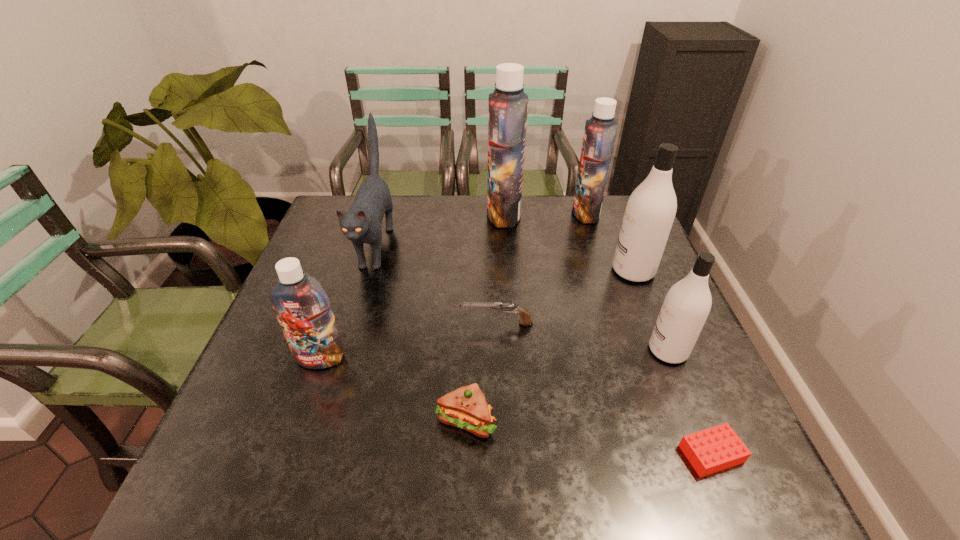
Where is `vacant area in the image that satisfies the following two spatial constraints: 1. aiming along the barrel of the fifth farthest object; 2. on the left side of the Lego`? The height and width of the screenshot is (540, 960). vacant area in the image that satisfies the following two spatial constraints: 1. aiming along the barrel of the fifth farthest object; 2. on the left side of the Lego is located at coordinates (502, 454).

Identify the location of blank space that satisfies the following two spatial constraints: 1. on the front-facing side of the farther white shampoo; 2. on the front label of the leftmost blue shampoo. (669, 359).

Image resolution: width=960 pixels, height=540 pixels. I want to click on free region that satisfies the following two spatial constraints: 1. on the front-facing side of the shortest object; 2. on the left side of the nearer white shampoo, so click(x=710, y=454).

Where is `vacant space that satisfies the following two spatial constraints: 1. on the front label of the leftmost blue shampoo; 2. on the left side of the shortest object`? vacant space that satisfies the following two spatial constraints: 1. on the front label of the leftmost blue shampoo; 2. on the left side of the shortest object is located at coordinates (288, 454).

You are a GUI agent. You are given a task and a screenshot of the screen. Output one action in this format:
    pyautogui.click(x=<x>, y=<y>)
    Task: Click on the vacant space that satisfies the following two spatial constraints: 1. on the front-facing side of the smaller white shampoo; 2. on the left side of the Lego
    
    Given the screenshot: What is the action you would take?
    pyautogui.click(x=710, y=454)

In order to click on free region that satisfies the following two spatial constraints: 1. on the front label of the nearest blue shampoo; 2. on the left side of the Lego in this screenshot , I will do `click(288, 454)`.